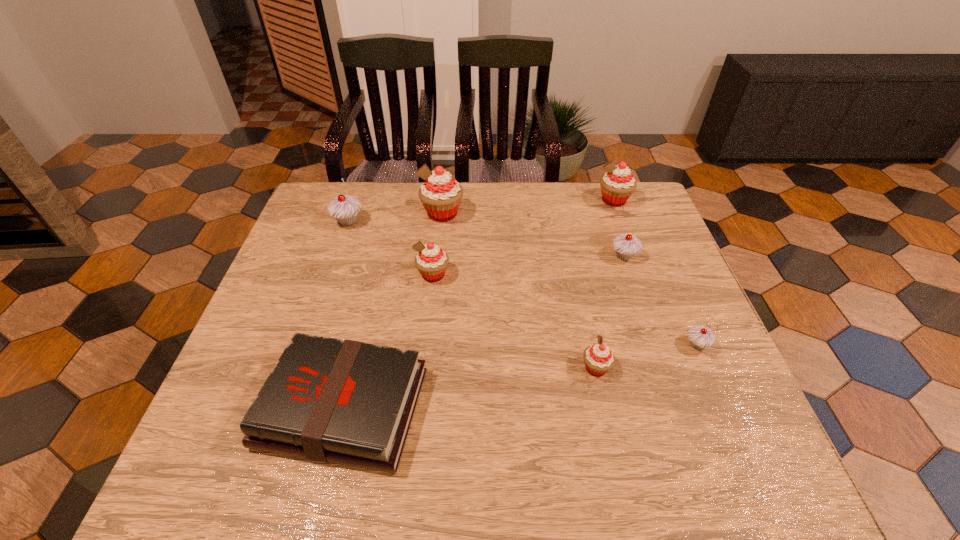
Locate an element on the screen. This screenshot has height=540, width=960. free location that satisfies the following two spatial constraints: 1. on the front side of the second smallest pink cupcake; 2. on the left side of the leftmost gray cupcake is located at coordinates (329, 274).

The height and width of the screenshot is (540, 960). What are the coordinates of `free location that satisfies the following two spatial constraints: 1. on the front side of the nearest gray cupcake; 2. on the right side of the biggest gray cupcake` in the screenshot? It's located at (305, 345).